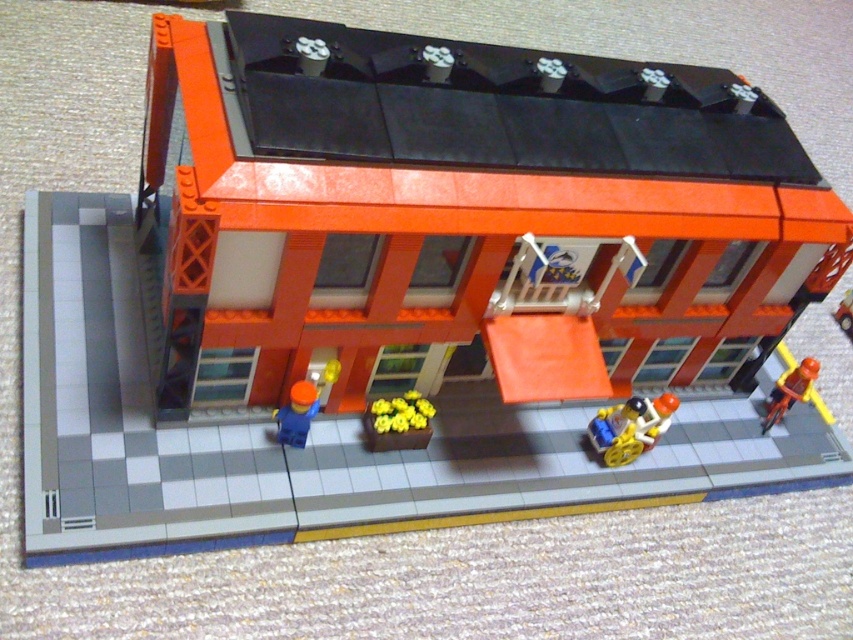
You are a delivery person needing to park your vehicle. You see an orange matte bicycle at right and a brick red car at right. Which vehicle is closer to the ground?

The orange matte bicycle at right is closer to the ground because it is below the brick red car at right.

You are a photographer standing in front of the LEGO building. You want to take a photo that includes both the yellow matte flowers at center and the blue matte figure at center. Which object should be placed closer to the camera to ensure both are in focus?

The yellow matte flowers at center is further to the viewer than the blue matte figure at center, so to ensure both are in focus, the yellow matte flowers at center should be placed closer to the camera.